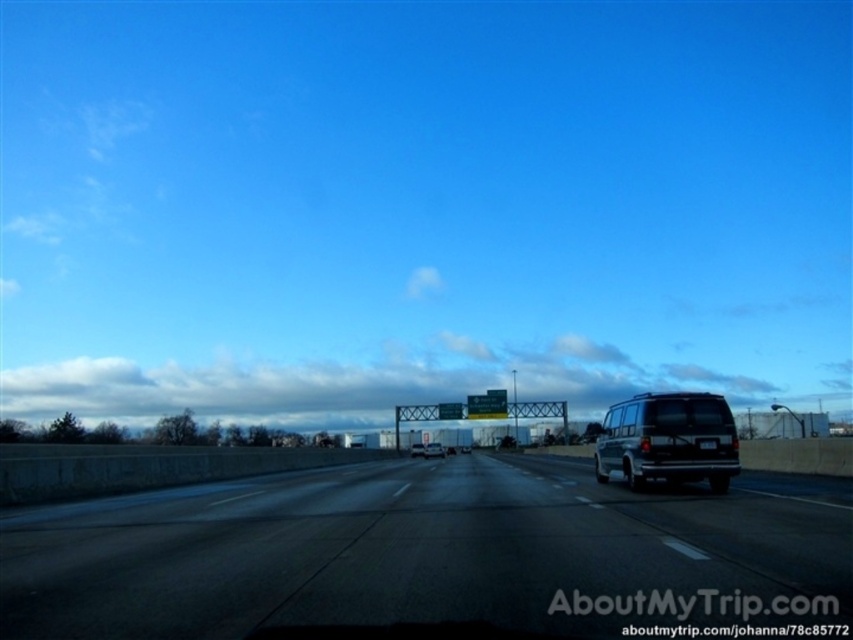
Is the position of silver metallic van at center more distant than that of white glossy van at center?

No, silver metallic van at center is in front of white glossy van at center.

Does point (682, 428) come in front of point (415, 454)?

Yes, point (682, 428) is in front of point (415, 454).

Based on the photo, who is more forward, (672, 412) or (410, 451)?

Point (672, 412) is in front.

The width and height of the screenshot is (853, 640). I want to click on silver metallic van at center, so click(x=668, y=440).

Can you confirm if matte black van at center is taller than metallic silver van at center?

Yes, matte black van at center is taller than metallic silver van at center.

Which is in front, point (425, 458) or point (469, 444)?

Point (425, 458) is more forward.

Who is more forward, (428, 451) or (468, 444)?

Point (428, 451) is more forward.

I want to click on matte black van at center, so [433, 449].

Can you confirm if black asphalt highway at center is positioned below metallic silver van at center?

Incorrect, black asphalt highway at center is not positioned below metallic silver van at center.

Is point (450, 509) closer to viewer compared to point (461, 445)?

Yes.

Where is `black asphalt highway at center`? black asphalt highway at center is located at coordinates (422, 554).